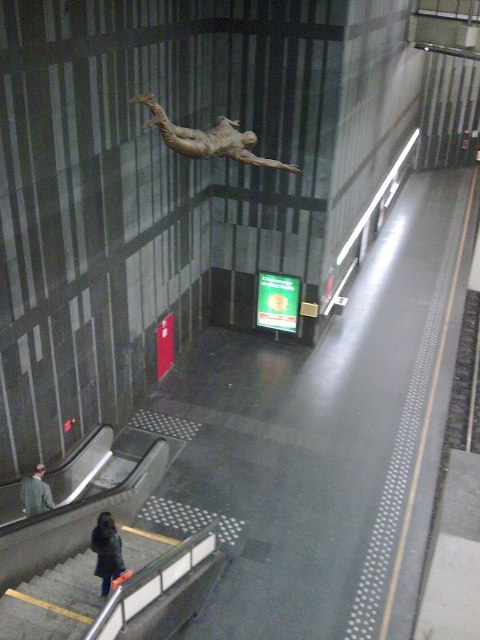
Between point (84, 611) and point (212, 131), which one is positioned in front?

Point (84, 611)

Is gray concrete stairs at lower left thinner than bronze statue at upper center?

Correct, gray concrete stairs at lower left's width is less than bronze statue at upper center's.

Describe the element at coordinates (52, 602) in the screenshot. I see `gray concrete stairs at lower left` at that location.

Locate an element on the screen. gray concrete stairs at lower left is located at coordinates (52, 602).

Who is more forward, (108, 534) or (23, 484)?

Point (108, 534)

The height and width of the screenshot is (640, 480). I want to click on dark gray jacket at lower left, so click(x=107, y=552).

The height and width of the screenshot is (640, 480). I want to click on dark gray jacket at lower left, so click(107, 552).

The image size is (480, 640). Describe the element at coordinates (52, 602) in the screenshot. I see `gray concrete stairs at lower left` at that location.

Can you confirm if gray concrete stairs at lower left is thinner than gray wool coat at lower left?

In fact, gray concrete stairs at lower left might be wider than gray wool coat at lower left.

Does point (52, 580) come farther from viewer compared to point (43, 465)?

That is False.

Locate an element on the screen. gray concrete stairs at lower left is located at coordinates (52, 602).